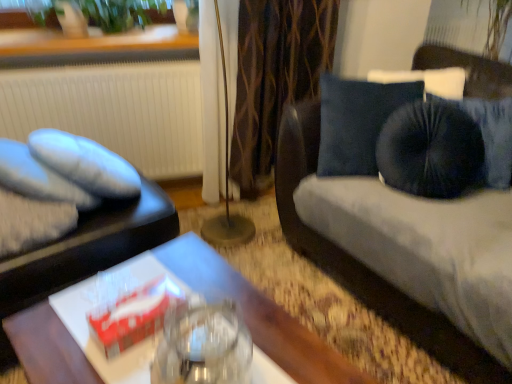
Question: Does wooden table at center have a smaller size compared to green leafy plant at upper left?

Choices:
 (A) yes
 (B) no

Answer: (B)

Question: Can you confirm if wooden table at center is bigger than green leafy plant at upper left?

Choices:
 (A) yes
 (B) no

Answer: (A)

Question: Does wooden table at center have a greater width compared to green leafy plant at upper left?

Choices:
 (A) no
 (B) yes

Answer: (B)

Question: Could you tell me if wooden table at center is turned towards green leafy plant at upper left?

Choices:
 (A) yes
 (B) no

Answer: (B)

Question: From a real-world perspective, is wooden table at center under green leafy plant at upper left?

Choices:
 (A) yes
 (B) no

Answer: (A)

Question: Considering the positions of soft gray fabric pillow at left and matte black tray at left in the image, is soft gray fabric pillow at left taller or shorter than matte black tray at left?

Choices:
 (A) tall
 (B) short

Answer: (B)

Question: Is soft gray fabric pillow at left to the left or to the right of matte black tray at left in the image?

Choices:
 (A) left
 (B) right

Answer: (A)

Question: Is soft gray fabric pillow at left in front of or behind matte black tray at left in the image?

Choices:
 (A) behind
 (B) front

Answer: (A)

Question: Considering the positions of soft gray fabric pillow at left and matte black tray at left in the image, is soft gray fabric pillow at left bigger or smaller than matte black tray at left?

Choices:
 (A) big
 (B) small

Answer: (B)

Question: Looking at the image, does green leafy plant at upper left seem bigger or smaller compared to wooden table at center?

Choices:
 (A) small
 (B) big

Answer: (A)

Question: Considering the positions of green leafy plant at upper left and wooden table at center in the image, is green leafy plant at upper left taller or shorter than wooden table at center?

Choices:
 (A) tall
 (B) short

Answer: (B)

Question: Is green leafy plant at upper left inside the boundaries of wooden table at center, or outside?

Choices:
 (A) inside
 (B) outside

Answer: (B)

Question: From a real-world perspective, is green leafy plant at upper left above or below wooden table at center?

Choices:
 (A) below
 (B) above

Answer: (B)

Question: Is metallic gold floor lamp at center taller or shorter than wooden table at center?

Choices:
 (A) short
 (B) tall

Answer: (B)

Question: In the image, is metallic gold floor lamp at center on the left side or the right side of wooden table at center?

Choices:
 (A) right
 (B) left

Answer: (A)